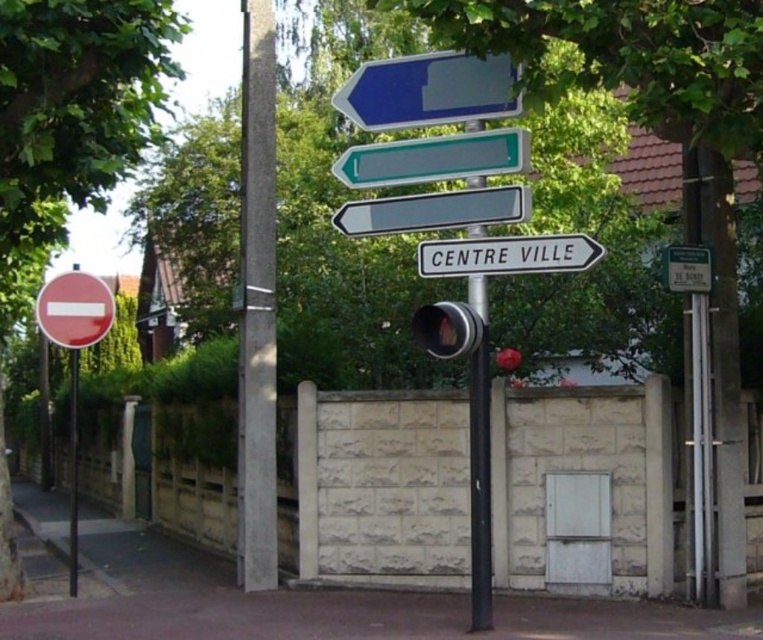
You are a pedestrian standing at the street corner and see the black metal pole at center and the black plastic sign at center. Which object is located to the left of the other?

The black plastic sign at center is located to the left of the black metal pole at center.

You are a delivery driver approaching the intersection and need to check the traffic signs. Which object, the white plastic sign at center or the metallic pole at left, would you notice first due to its size?

The metallic pole at left is larger in size compared to the white plastic sign at center, so you would notice the metallic pole at left first.

You are a delivery driver approaching the intersection and need to make a turn. You see the black plastic sign at center and the green plastic sign at upper right on the signpost. Which of these two signs is larger in size?

The black plastic sign at center is bigger than the green plastic sign at upper right.